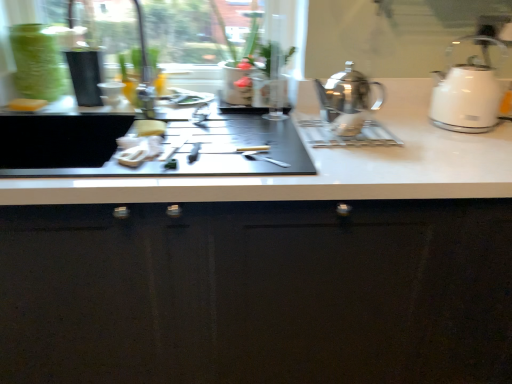
Question: Considering the relative positions of yellow sponge at center, marked as the 2th food in a right-to-left arrangement, and shiny metallic kettle at center, the second kettle when ordered from right to left, in the image provided, is yellow sponge at center, marked as the 2th food in a right-to-left arrangement, to the left of shiny metallic kettle at center, the second kettle when ordered from right to left, from the viewer's perspective?

Choices:
 (A) yes
 (B) no

Answer: (A)

Question: Does yellow sponge at center, which ranks as the second food in front-to-back order, have a greater height compared to shiny metallic kettle at center, the second kettle when ordered from right to left?

Choices:
 (A) no
 (B) yes

Answer: (A)

Question: Is yellow sponge at center, acting as the 2th food starting from the bottom, far away from shiny metallic kettle at center, the second kettle when ordered from right to left?

Choices:
 (A) yes
 (B) no

Answer: (B)

Question: Is yellow sponge at center, which ranks as the second food in front-to-back order, at the right side of shiny metallic kettle at center, the second kettle when ordered from right to left?

Choices:
 (A) no
 (B) yes

Answer: (A)

Question: Is yellow sponge at center, acting as the 2th food starting from the bottom, smaller than shiny metallic kettle at center, which appears as the first kettle when viewed from the left?

Choices:
 (A) no
 (B) yes

Answer: (B)

Question: Is point (95, 264) closer or farther from the camera than point (482, 41)?

Choices:
 (A) closer
 (B) farther

Answer: (A)

Question: From a real-world perspective, is glossy black cabinet at center physically located above or below white glossy kettle at right, acting as the 1th kettle starting from the right?

Choices:
 (A) below
 (B) above

Answer: (A)

Question: In terms of width, does glossy black cabinet at center look wider or thinner when compared to white glossy kettle at right, which is the second kettle in left-to-right order?

Choices:
 (A) wide
 (B) thin

Answer: (A)

Question: Looking at the image, does glossy black cabinet at center seem bigger or smaller compared to white glossy kettle at right, acting as the 1th kettle starting from the right?

Choices:
 (A) small
 (B) big

Answer: (B)

Question: In terms of size, does white matte sponge at left, which ranks as the 1th food in back-to-front order, appear bigger or smaller than shiny metallic kettle at center, the second kettle when ordered from right to left?

Choices:
 (A) big
 (B) small

Answer: (B)

Question: In the image, is white matte sponge at left, the 3th food when ordered from front to back, positioned in front of or behind shiny metallic kettle at center, the second kettle when ordered from right to left?

Choices:
 (A) front
 (B) behind

Answer: (B)

Question: From a real-world perspective, relative to shiny metallic kettle at center, the second kettle when ordered from right to left, is white matte sponge at left, acting as the third food starting from the right, vertically above or below?

Choices:
 (A) above
 (B) below

Answer: (B)

Question: From the image's perspective, is white matte sponge at left, the 3th food when ordered from front to back, positioned above or below shiny metallic kettle at center, which appears as the first kettle when viewed from the left?

Choices:
 (A) below
 (B) above

Answer: (B)

Question: In terms of width, does white fabric napkin at center, which appears as the 3th food when viewed from the left, look wider or thinner when compared to glossy black cabinet at center?

Choices:
 (A) thin
 (B) wide

Answer: (A)

Question: Relative to glossy black cabinet at center, is white fabric napkin at center, the 1th food from the front, in front or behind?

Choices:
 (A) front
 (B) behind

Answer: (B)